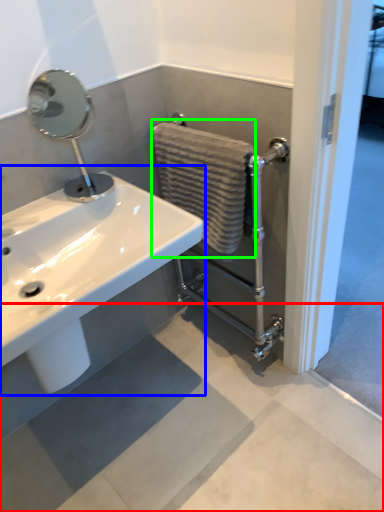
Question: Which is nearer to the concrete (highlighted by a red box)? sink (highlighted by a blue box) or bath towel (highlighted by a green box).

Choices:
 (A) sink
 (B) bath towel

Answer: (A)